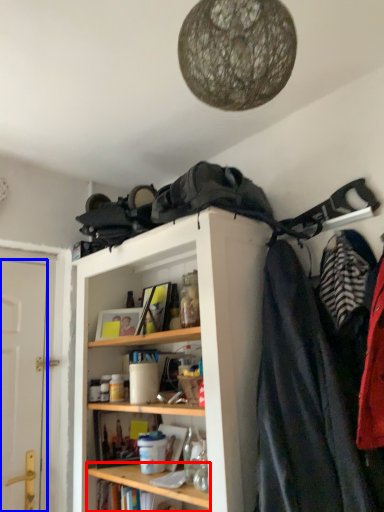
Question: Which of the following is the farthest to the observer, cabinet (highlighted by a red box) or door (highlighted by a blue box)?

Choices:
 (A) cabinet
 (B) door

Answer: (B)